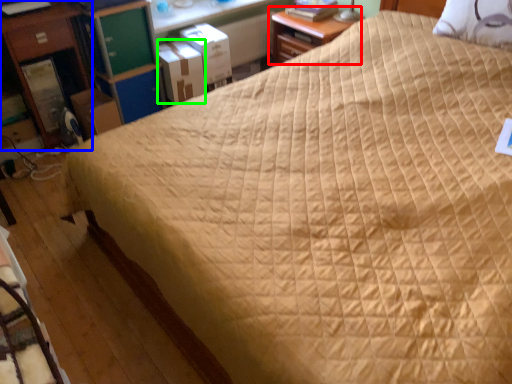
Question: Considering the real-world distances, which object is farthest from nightstand (highlighted by a red box)? nightstand (highlighted by a blue box) or cardboard box (highlighted by a green box)?

Choices:
 (A) nightstand
 (B) cardboard box

Answer: (A)